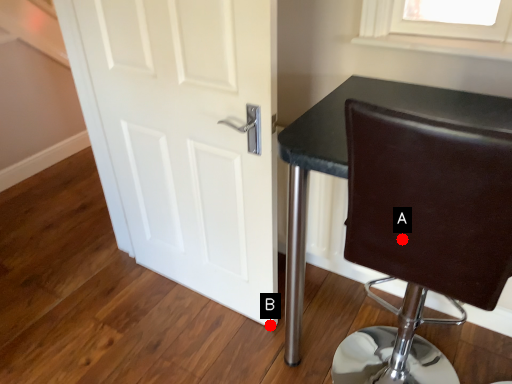
Question: Two points are circled on the image, labeled by A and B beside each circle. Among these points, which one is nearest to the camera?

Choices:
 (A) A is closer
 (B) B is closer

Answer: (A)